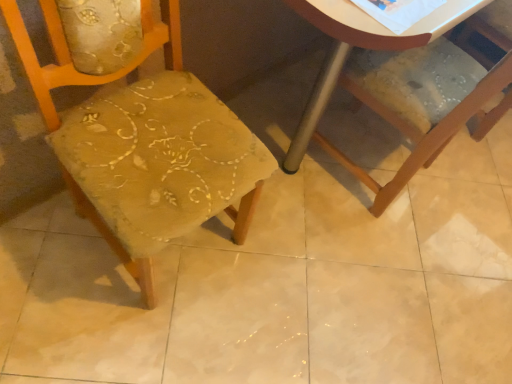
Question: From the image's perspective, is wooden chair at lower right, positioned as the 2th chair in left-to-right order, below textured fabric chair at center, positioned as the first chair in left-to-right order?

Choices:
 (A) no
 (B) yes

Answer: (A)

Question: Would you say wooden chair at lower right, positioned as the 2th chair in left-to-right order, is a long distance from textured fabric chair at center, positioned as the first chair in left-to-right order?

Choices:
 (A) yes
 (B) no

Answer: (B)

Question: Can textured fabric chair at center, placed as the second chair when sorted from right to left, be found inside wooden chair at lower right, positioned as the 2th chair in left-to-right order?

Choices:
 (A) no
 (B) yes

Answer: (A)

Question: Can we say wooden chair at lower right, which is counted as the 1th chair, starting from the right, lies outside textured fabric chair at center, positioned as the first chair in left-to-right order?

Choices:
 (A) yes
 (B) no

Answer: (A)

Question: Is wooden chair at lower right, which is counted as the 1th chair, starting from the right, oriented towards textured fabric chair at center, placed as the second chair when sorted from right to left?

Choices:
 (A) no
 (B) yes

Answer: (A)

Question: Can you confirm if wooden chair at lower right, positioned as the 2th chair in left-to-right order, is taller than textured fabric chair at center, positioned as the first chair in left-to-right order?

Choices:
 (A) no
 (B) yes

Answer: (A)

Question: Could you tell me if textured fabric chair at center, placed as the second chair when sorted from right to left, is facing wooden chair at lower right, which is counted as the 1th chair, starting from the right?

Choices:
 (A) yes
 (B) no

Answer: (B)

Question: Considering the relative sizes of textured fabric chair at center, placed as the second chair when sorted from right to left, and wooden chair at lower right, which is counted as the 1th chair, starting from the right, in the image provided, is textured fabric chair at center, placed as the second chair when sorted from right to left, wider than wooden chair at lower right, which is counted as the 1th chair, starting from the right,?

Choices:
 (A) yes
 (B) no

Answer: (B)

Question: Does textured fabric chair at center, placed as the second chair when sorted from right to left, appear on the left side of wooden chair at lower right, positioned as the 2th chair in left-to-right order?

Choices:
 (A) no
 (B) yes

Answer: (B)

Question: Is wooden chair at lower right, which is counted as the 1th chair, starting from the right, at the back of textured fabric chair at center, positioned as the first chair in left-to-right order?

Choices:
 (A) yes
 (B) no

Answer: (B)

Question: From a real-world perspective, is textured fabric chair at center, positioned as the first chair in left-to-right order, physically below wooden chair at lower right, positioned as the 2th chair in left-to-right order?

Choices:
 (A) yes
 (B) no

Answer: (B)

Question: Is textured fabric chair at center, positioned as the first chair in left-to-right order, not within wooden chair at lower right, which is counted as the 1th chair, starting from the right?

Choices:
 (A) yes
 (B) no

Answer: (A)

Question: Is point (480, 102) positioned closer to the camera than point (148, 46)?

Choices:
 (A) closer
 (B) farther

Answer: (B)